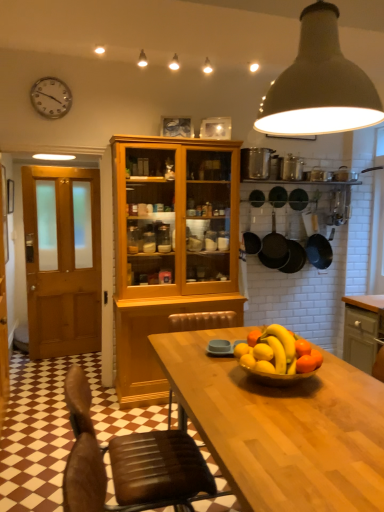
Locate an element on the screen. free space above wooden door at left (from a real-world perspective) is located at coordinates (58, 134).